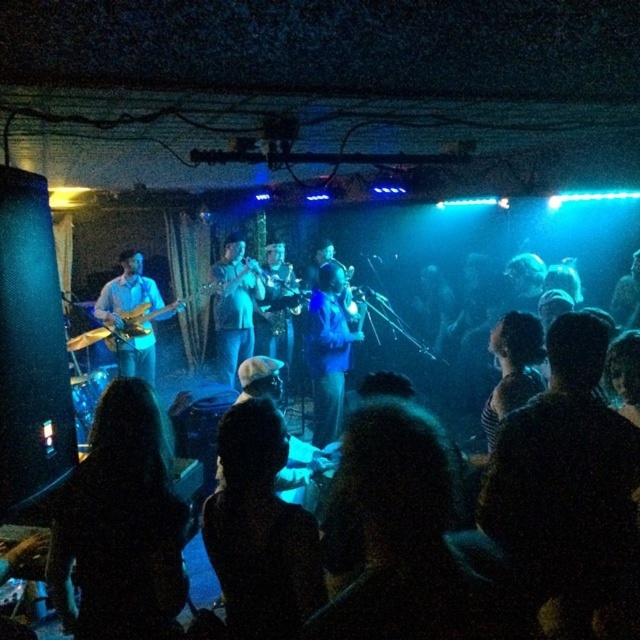
You are a photographer trying to capture a closeup of the black matte head at center and the matte blue shirt at center during the performance. Since your camera has a fixed focal length, you need to know which object is narrower to frame properly. Which one has a smaller width?

The black matte head at center has a smaller width than the matte blue shirt at center according to the description.

You are a photographer at the back of the venue and want to capture a clear shot of both the black matte head at center and the matte wood guitar at left without any overlap. Given their sizes, which object should you focus on first to ensure it fits in the frame?

The black matte head at center is thinner than the matte wood guitar at left, so you should focus on capturing the matte wood guitar at left first since it is wider and requires more space in the frame to avoid overlap.